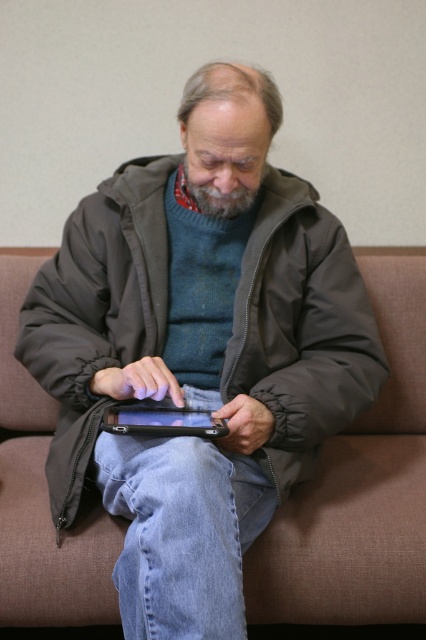
You are standing 1.11 meters away from the camera. If you want to reach the point at coordinates point (134, 420), can you do so without moving closer than your current distance?

The point (134, 420) is exactly 1.11 meters away from the camera, so you can reach it without moving closer than your current distance of 1.11 meters.

You are standing in front of the couch where the man is sitting. If you want to place a small object on the black glossy tablet at center, where should you aim based on its position?

The black glossy tablet at center is located at coordinates point (161, 420), so you should aim for that specific point to place the small object on it.